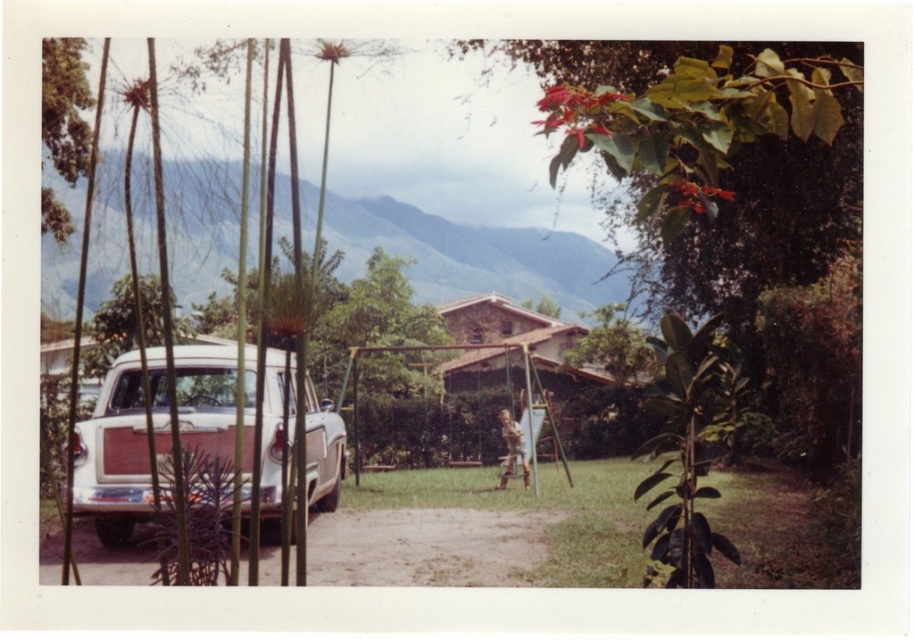
Question: Can you confirm if matte white station wagon at left is bigger than green leafy tree at upper left?

Choices:
 (A) yes
 (B) no

Answer: (A)

Question: Where is matte white station wagon at left located in relation to green leafy tree at upper left in the image?

Choices:
 (A) below
 (B) above

Answer: (A)

Question: Does matte white station wagon at left appear under green leafy tree at upper left?

Choices:
 (A) no
 (B) yes

Answer: (B)